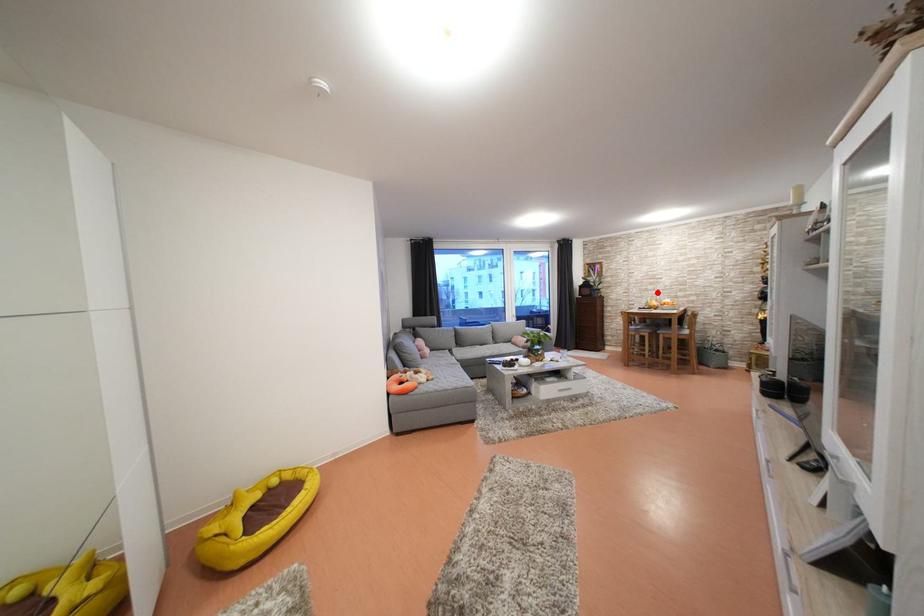
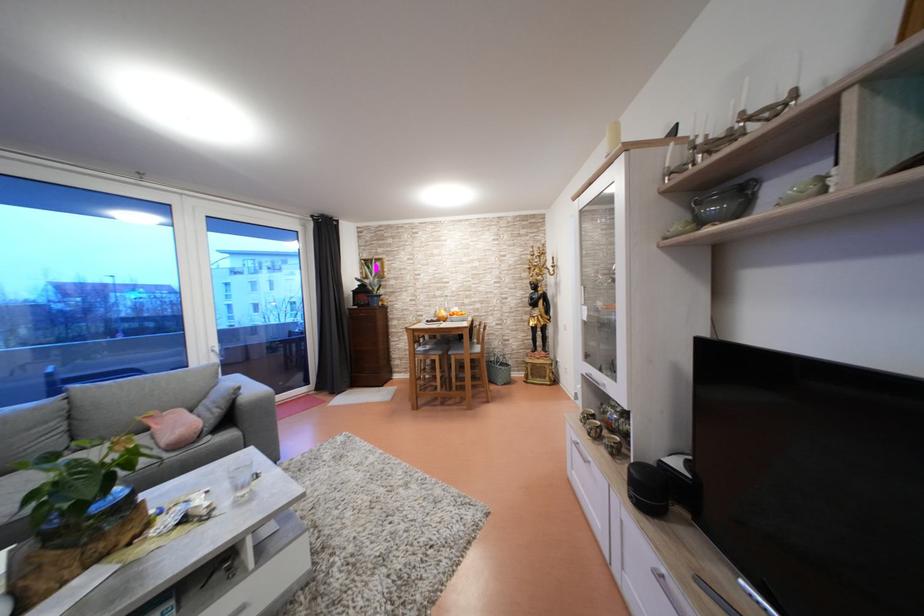
In the second image, find the point that corresponds to the highlighted location in the first image.

(444, 299)